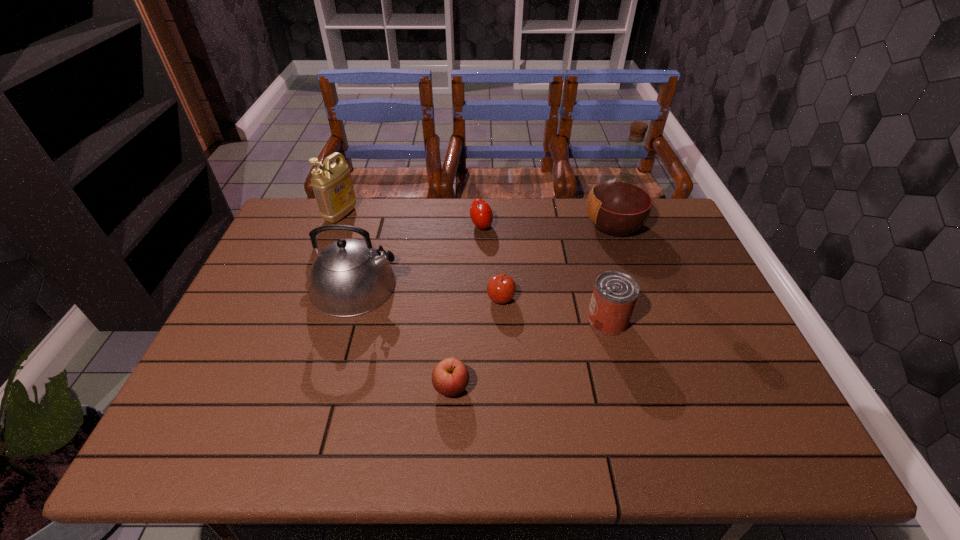
The width and height of the screenshot is (960, 540). I want to click on liquor, so click(x=618, y=205).

In order to click on detergent in this screenshot , I will do `click(332, 184)`.

You are a GUI agent. You are given a task and a screenshot of the screen. Output one action in this format:
    pyautogui.click(x=<x>, y=<y>)
    Task: Click on the kettle
    
    Given the screenshot: What is the action you would take?
    coord(349,277)

Locate an element on the screen. This screenshot has width=960, height=540. can is located at coordinates (615, 293).

You are a GUI agent. You are given a task and a screenshot of the screen. Output one action in this format:
    pyautogui.click(x=<x>, y=<y>)
    Task: Click on the farthest apple
    
    Given the screenshot: What is the action you would take?
    pyautogui.click(x=481, y=214)

This screenshot has height=540, width=960. Identify the location of the second nearest apple. (501, 288).

Where is `the nearest apple`? This screenshot has height=540, width=960. the nearest apple is located at coordinates (450, 377).

Where is `free region located 0.260m on the front label of the liquor`? free region located 0.260m on the front label of the liquor is located at coordinates (506, 225).

The width and height of the screenshot is (960, 540). Identify the location of free location located 0.360m on the front label of the liquor. (475, 225).

This screenshot has height=540, width=960. I want to click on free spot located on the front label of the liquor, so click(493, 225).